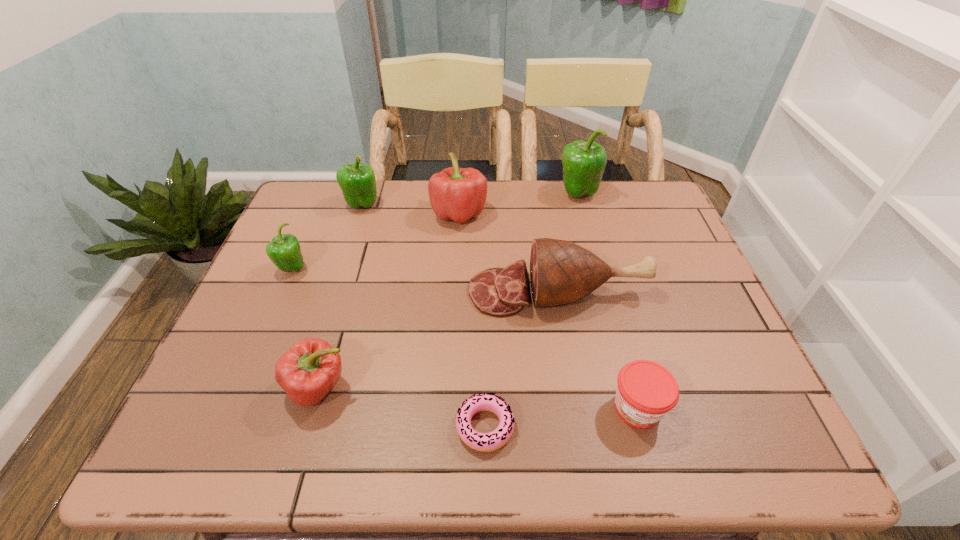
Locate an element on the screen. vacant space at the left edge of the desktop is located at coordinates (274, 271).

In the image, there is a desktop. Identify the location of vacant space at the right edge. The image size is (960, 540). (702, 413).

You are a GUI agent. You are given a task and a screenshot of the screen. Output one action in this format:
    pyautogui.click(x=<x>, y=<y>)
    Task: Click on the vacant space at the far right corner of the desktop
    
    Given the screenshot: What is the action you would take?
    pyautogui.click(x=648, y=190)

Identify the location of free space at the near right corner of the desktop. The image size is (960, 540). (702, 420).

Locate an element on the screen. The width and height of the screenshot is (960, 540). free space that is in between the nearest green bell pepper and the tallest object is located at coordinates (435, 231).

Find the location of a particular element. This screenshot has width=960, height=540. free space that is in between the left pink bell pepper and the farther pink bell pepper is located at coordinates (389, 301).

What are the coordinates of `vacant space that is in between the pink doughnut and the second smallest green bell pepper` in the screenshot? It's located at (423, 315).

Locate an element on the screen. Image resolution: width=960 pixels, height=540 pixels. free spot between the second green bell pepper from left to right and the pink doughnut is located at coordinates (423, 315).

Identify the location of free space between the left pink bell pepper and the doughnut. (402, 407).

Find the location of `empty location between the smaller pink bell pepper and the doughnut`. empty location between the smaller pink bell pepper and the doughnut is located at coordinates (402, 407).